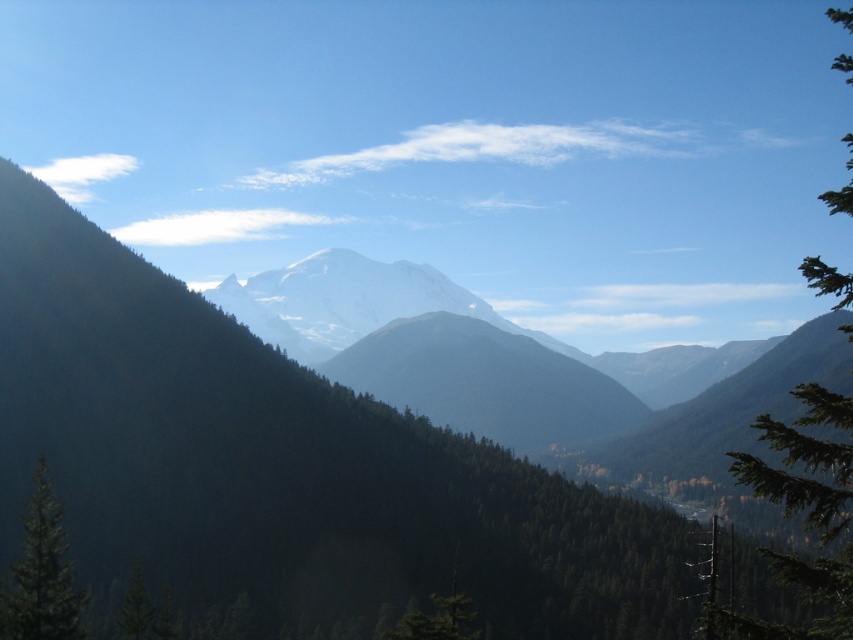
Who is more distant from viewer, (839, 307) or (44, 582)?

Positioned behind is point (44, 582).

From the picture: Does green textured tree at right appear on the left side of green textured tree at lower left?

No, green textured tree at right is not to the left of green textured tree at lower left.

This screenshot has width=853, height=640. Describe the element at coordinates (805, 509) in the screenshot. I see `green textured tree at right` at that location.

Where is `green textured tree at right`? green textured tree at right is located at coordinates (805, 509).